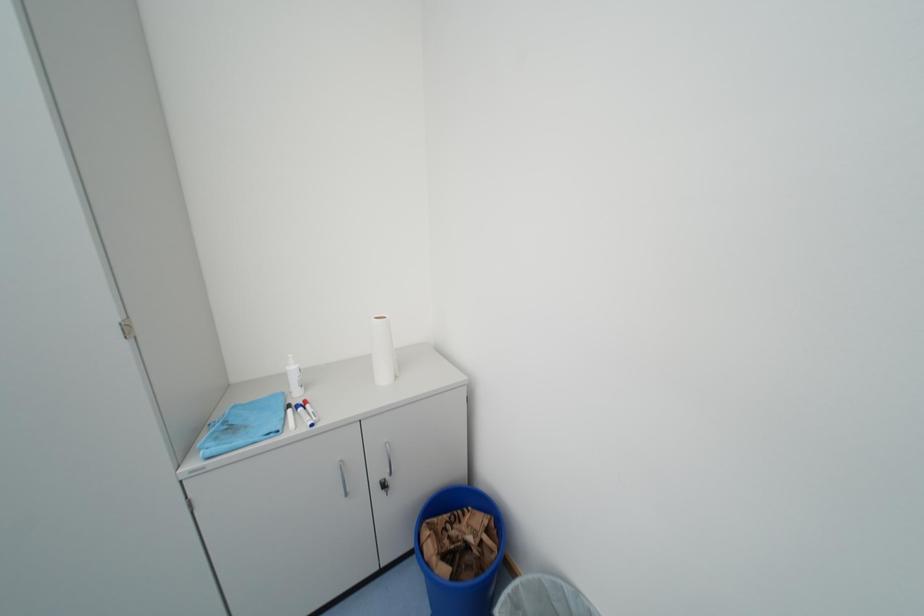
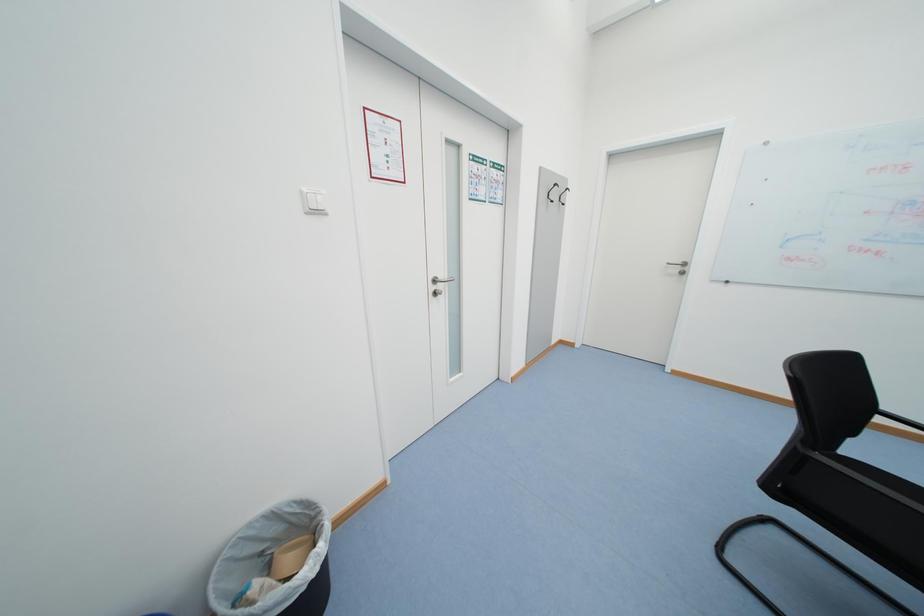
The first image is from the beginning of the video and the second image is from the end. How did the camera likely rotate when shooting the video?

The camera rotated toward right-down.